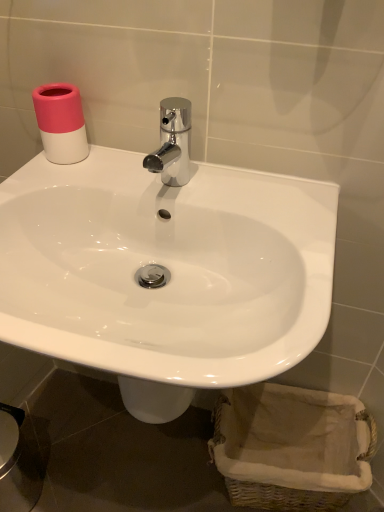
What do you see at coordinates (164, 271) in the screenshot? I see `white glossy sink at center` at bounding box center [164, 271].

Locate an element on the screen. The height and width of the screenshot is (512, 384). white glossy sink at center is located at coordinates coord(164,271).

Measure the distance between point (37,120) and camera.

Point (37,120) is 78.30 centimeters away from camera.

This screenshot has height=512, width=384. Describe the element at coordinates (291, 447) in the screenshot. I see `woven beige basket at lower right` at that location.

The image size is (384, 512). I want to click on woven beige basket at lower right, so click(x=291, y=447).

Identify the location of white glossy sink at center. This screenshot has width=384, height=512. (164, 271).

From the picture: Can we say white glossy sink at center lies outside woven beige basket at lower right?

Yes, white glossy sink at center is outside of woven beige basket at lower right.

Which is closer, [160,362] or [250,490]?

Point [160,362] is closer to the camera than point [250,490].

From a real-world perspective, which object stands above the other?

white glossy sink at center.

Looking at this image, considering the relative sizes of chrome metallic faucet at center and white glossy sink at center in the image provided, is chrome metallic faucet at center taller than white glossy sink at center?

In fact, chrome metallic faucet at center may be shorter than white glossy sink at center.

Looking at this image, from the image's perspective, is chrome metallic faucet at center under white glossy sink at center?

Actually, chrome metallic faucet at center appears above white glossy sink at center in the image.

Is chrome metallic faucet at center thinner than white glossy sink at center?

Yes.

Measure the distance between chrome metallic faucet at center and white glossy sink at center.

The distance of chrome metallic faucet at center from white glossy sink at center is 6.71 inches.

Can you tell me how much woven beige basket at lower right and white glossy sink at center differ in facing direction?

They differ by 9.22 degrees in their facing directions.

From the image's perspective, would you say woven beige basket at lower right is shown under white glossy sink at center?

Correct, woven beige basket at lower right appears lower than white glossy sink at center in the image.

There is a woven beige basket at lower right. At what (x,y) coordinates should I click in order to perform the action: click on sink above it (from a real-world perspective). Please return your answer as a coordinate pair (x, y). Looking at the image, I should click on (164, 271).

Between woven beige basket at lower right and white glossy sink at center, which one has smaller width?

woven beige basket at lower right.

From the image's perspective, is pink matte toilet paper at upper left on woven beige basket at lower right?

Yes, from the image's perspective, pink matte toilet paper at upper left is on top of woven beige basket at lower right.

Considering the sizes of objects pink matte toilet paper at upper left and woven beige basket at lower right in the image provided, who is smaller, pink matte toilet paper at upper left or woven beige basket at lower right?

With smaller size is pink matte toilet paper at upper left.

Could you tell me if pink matte toilet paper at upper left is facing woven beige basket at lower right?

No, pink matte toilet paper at upper left is not aimed at woven beige basket at lower right.

Is pink matte toilet paper at upper left taller than woven beige basket at lower right?

No, pink matte toilet paper at upper left is not taller than woven beige basket at lower right.

Is pink matte toilet paper at upper left at the left side of white glossy sink at center?

Yes.

Is point (78, 91) closer or farther from the camera than point (62, 322)?

Point (78, 91) appears to be farther away from the viewer than point (62, 322).

From the image's perspective, which is below, pink matte toilet paper at upper left or white glossy sink at center?

white glossy sink at center.

From their relative heights in the image, would you say pink matte toilet paper at upper left is taller or shorter than white glossy sink at center?

Clearly, pink matte toilet paper at upper left is shorter compared to white glossy sink at center.

Does white glossy sink at center turn towards pink matte toilet paper at upper left?

No.

From a real-world perspective, who is located lower, white glossy sink at center or pink matte toilet paper at upper left?

In real-world perspective, white glossy sink at center is lower.

Can you confirm if white glossy sink at center is taller than pink matte toilet paper at upper left?

Yes, white glossy sink at center is taller than pink matte toilet paper at upper left.

Consider the image. Which of these two, chrome metallic faucet at center or woven beige basket at lower right, is thinner?

chrome metallic faucet at center.

Which of these two, chrome metallic faucet at center or woven beige basket at lower right, stands taller?

Standing taller between the two is woven beige basket at lower right.

Is chrome metallic faucet at center turned away from woven beige basket at lower right?

chrome metallic faucet at center does not have its back to woven beige basket at lower right.

Which object is closer to the camera, chrome metallic faucet at center or woven beige basket at lower right?

Positioned in front is chrome metallic faucet at center.

Locate an element on the screen. Image resolution: width=384 pixels, height=512 pixels. sink that appears above the woven beige basket at lower right (from a real-world perspective) is located at coordinates (164, 271).

What are the coordinates of `plumbing fixture behind the white glossy sink at center` in the screenshot? It's located at (173, 144).

Estimate the real-world distances between objects in this image. Which object is further from pink matte toilet paper at upper left, woven beige basket at lower right or white glossy sink at center?

Among the two, woven beige basket at lower right is located further to pink matte toilet paper at upper left.

Looking at this image, from the image, which object appears to be nearer to woven beige basket at lower right, pink matte toilet paper at upper left or chrome metallic faucet at center?

chrome metallic faucet at center is closer to woven beige basket at lower right.

Considering their positions, is white glossy sink at center positioned further to chrome metallic faucet at center than woven beige basket at lower right?

woven beige basket at lower right is further to chrome metallic faucet at center.

When comparing their distances from chrome metallic faucet at center, does white glossy sink at center or pink matte toilet paper at upper left seem further?

white glossy sink at center is positioned further to the anchor chrome metallic faucet at center.

Considering their positions, is woven beige basket at lower right positioned further to pink matte toilet paper at upper left than chrome metallic faucet at center?

woven beige basket at lower right is positioned further to the anchor pink matte toilet paper at upper left.

Estimate the real-world distances between objects in this image. Which object is further from white glossy sink at center, chrome metallic faucet at center or pink matte toilet paper at upper left?

pink matte toilet paper at upper left.

Based on their spatial positions, is pink matte toilet paper at upper left or white glossy sink at center closer to woven beige basket at lower right?

white glossy sink at center.

In the scene shown: Based on their spatial positions, is pink matte toilet paper at upper left or woven beige basket at lower right further from chrome metallic faucet at center?

The object further to chrome metallic faucet at center is woven beige basket at lower right.

You are a GUI agent. You are given a task and a screenshot of the screen. Output one action in this format:
    pyautogui.click(x=<x>, y=<y>)
    Task: Click on the plumbing fixture between pink matte toilet paper at upper left and woven beige basket at lower right in the up-down direction
    
    Given the screenshot: What is the action you would take?
    pyautogui.click(x=173, y=144)

This screenshot has width=384, height=512. Identify the location of sink between pink matte toilet paper at upper left and woven beige basket at lower right from top to bottom. (164, 271).

In order to click on plumbing fixture between pink matte toilet paper at upper left and white glossy sink at center in the vertical direction in this screenshot , I will do [x=173, y=144].

The height and width of the screenshot is (512, 384). Identify the location of sink between chrome metallic faucet at center and woven beige basket at lower right from top to bottom. (164, 271).